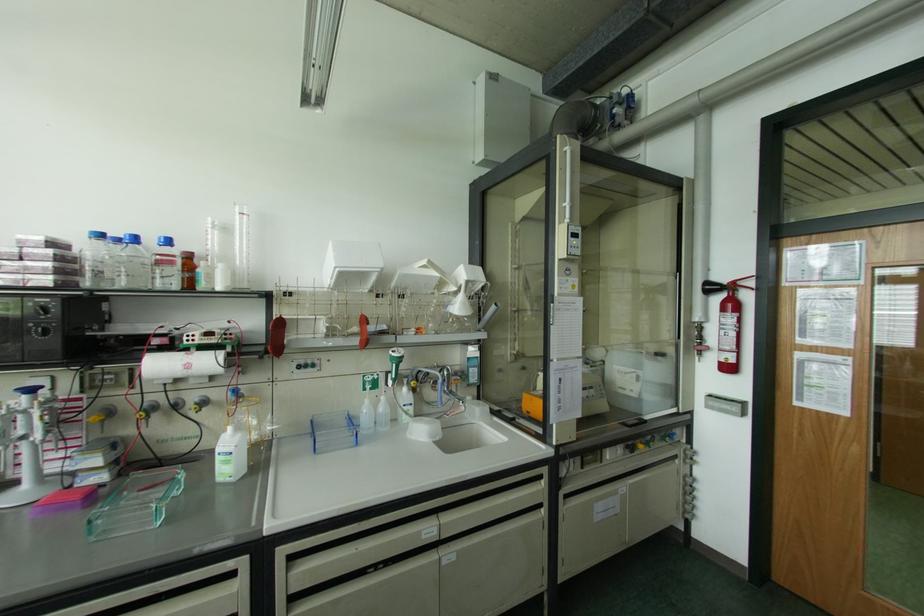
Where would you grasp the extinguisher handle? Please return your answer as a coordinate pair (x, y).

(712, 286)